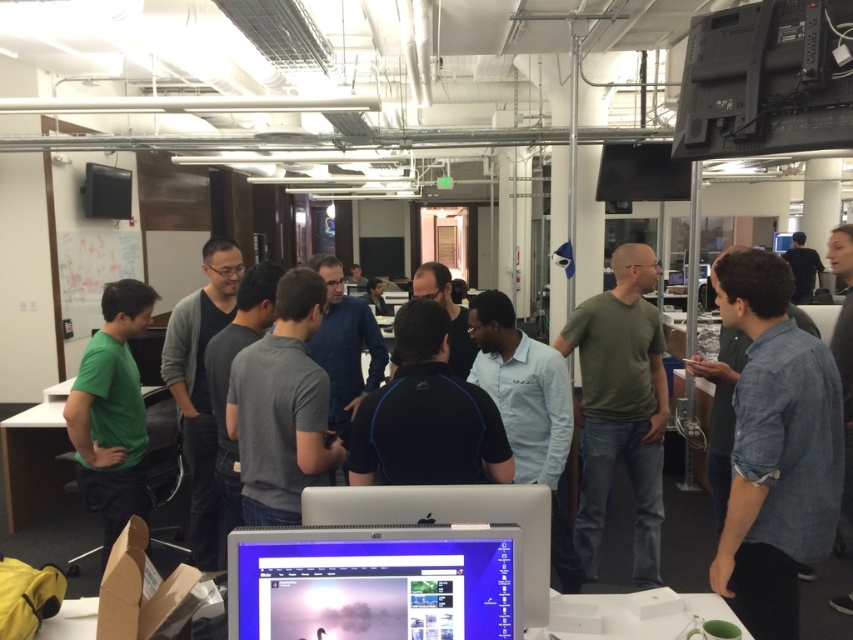
In the office scene, there are two people wearing a green matte shirt at left and a black shirt at upper right. Which one is positioned more to the left?

The green matte shirt at left is positioned more to the left than the black shirt at upper right.

You are a photographer standing at the entrance of the office. You need to take a photo of the green matte shirt at left. Where should you position yourself to capture the shirt in the frame?

The green matte shirt at left is located at point 0.644 on the x axis and 0.132 on the y axis, so you should position yourself to the left side of the frame to capture it.

You are standing in the office and want to locate the exact position of the point labeled as point (374, 582). According to the scene description, where is this point located?

The point (374, 582) is on the matte black monitor at center.